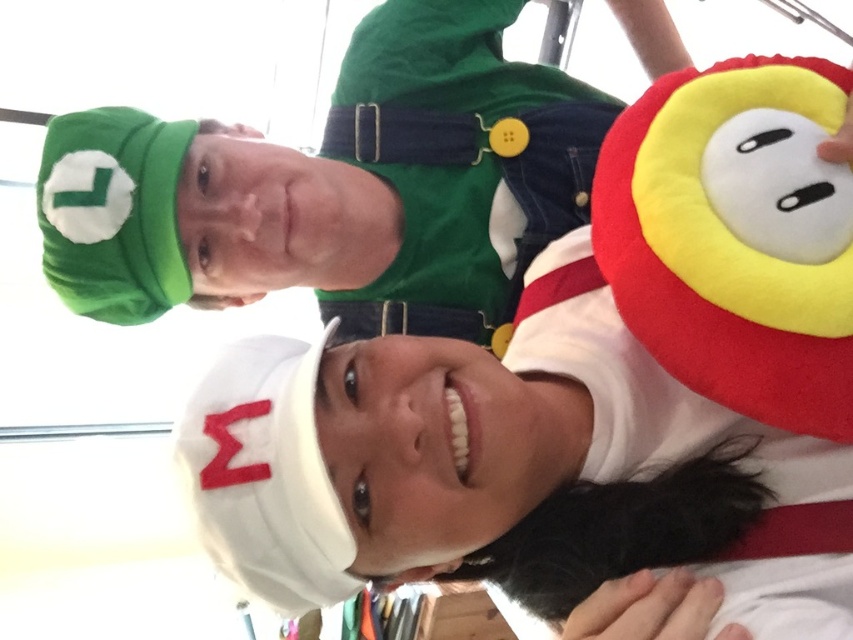
You are a photographer setting up for a group photo. You see the velvet green hat at upper left and the soft plush hat at right. Which hat is located more to the left side of the image?

The velvet green hat at upper left is more to the left side of the image than the soft plush hat at right.